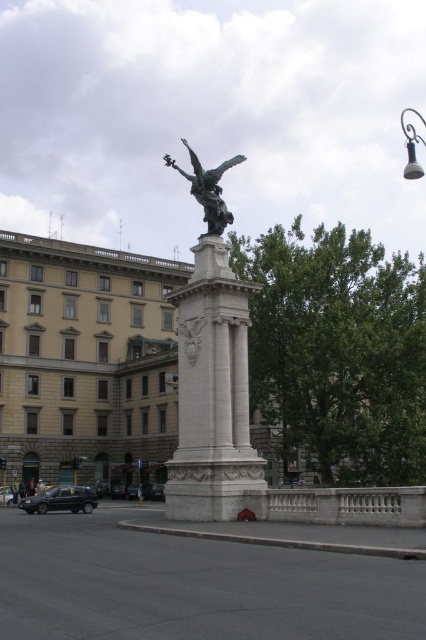
Who is positioned more to the right, shiny black car at lower left or metallic silver car at lower left?

metallic silver car at lower left is more to the right.

You are a GUI agent. You are given a task and a screenshot of the screen. Output one action in this format:
    pyautogui.click(x=<x>, y=<y>)
    Task: Click on the shiny black car at lower left
    
    Given the screenshot: What is the action you would take?
    pyautogui.click(x=60, y=500)

Between green patina statue at upper center and metallic silver car at lower left, which one has more height?

green patina statue at upper center is taller.

Between point (218, 189) and point (160, 486), which one is positioned in front?

Positioned in front is point (218, 189).

Which is in front, point (192, 192) or point (154, 490)?

Point (192, 192) is in front.

This screenshot has height=640, width=426. I want to click on green patina statue at upper center, so click(x=207, y=188).

What do you see at coordinates (212, 371) in the screenshot? I see `bronze statue at center` at bounding box center [212, 371].

Can you confirm if bronze statue at center is taller than metallic at upper right?

No, bronze statue at center is not taller than metallic at upper right.

Describe the element at coordinates (212, 371) in the screenshot. The height and width of the screenshot is (640, 426). I see `bronze statue at center` at that location.

I want to click on bronze statue at center, so click(x=212, y=371).